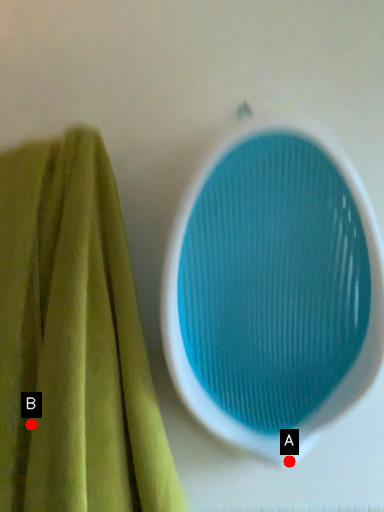
Question: Two points are circled on the image, labeled by A and B beside each circle. Among these points, which one is farthest from the camera?

Choices:
 (A) A is further
 (B) B is further

Answer: (A)